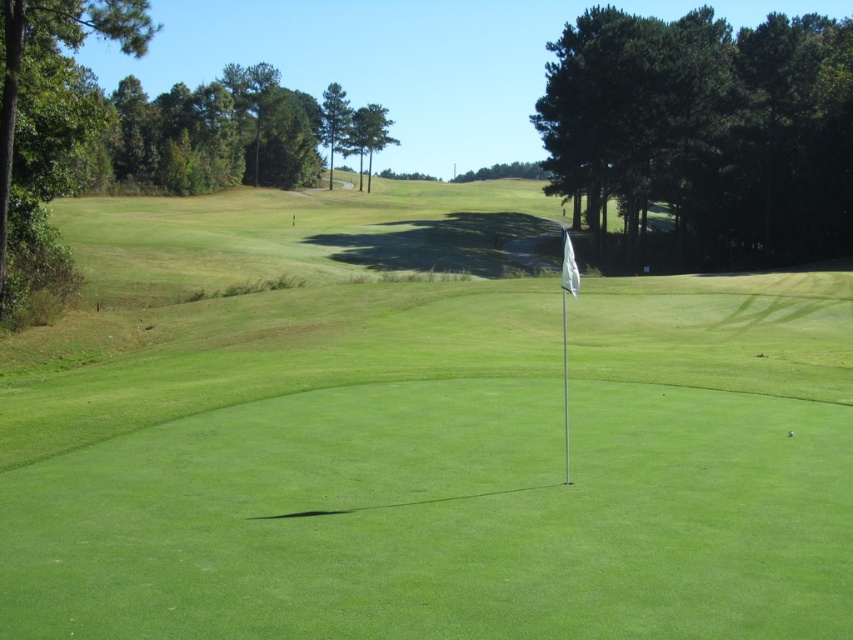
Consider the image. Does green grass flag at center appear over green matte golf ball at center?

Indeed, green grass flag at center is positioned over green matte golf ball at center.

Based on the photo, which is more to the right, green grass flag at center or green matte golf ball at center?

From the viewer's perspective, green matte golf ball at center appears more on the right side.

Who is more distant from viewer, (718, 564) or (787, 436)?

The point (787, 436) is behind.

Where is `green grass flag at center`? This screenshot has height=640, width=853. green grass flag at center is located at coordinates (416, 433).